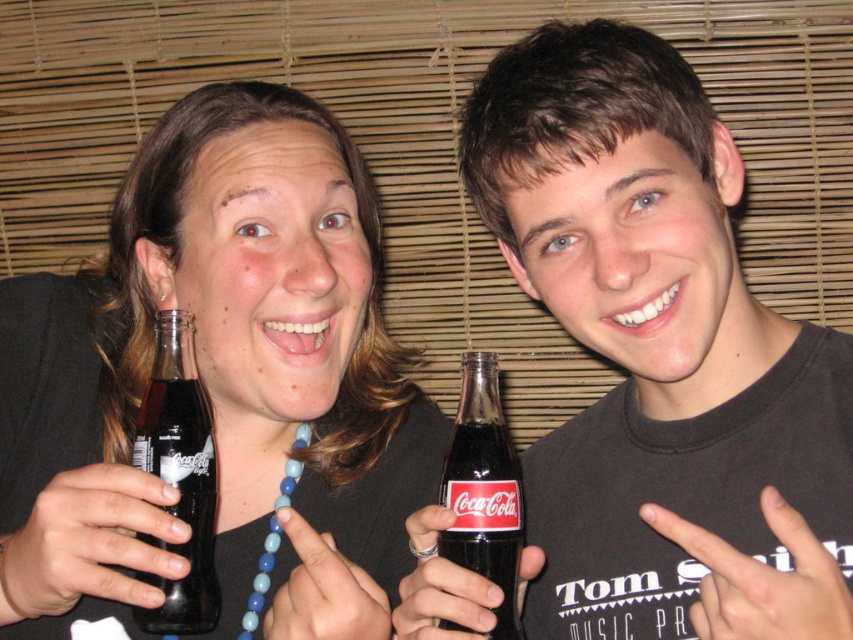
Question: Estimate the real-world distances between objects in this image. Which object is farther from the black glass coca-cola bottle at left?

Choices:
 (A) translucent glass bottle at left
 (B) black glass bottle at right
 (C) black glass coca-cola bottle at center

Answer: (B)

Question: Does black glass bottle at right come behind black glass coca-cola bottle at left?

Choices:
 (A) no
 (B) yes

Answer: (A)

Question: Is black glass bottle at right bigger than black glass coca-cola bottle at center?

Choices:
 (A) no
 (B) yes

Answer: (B)

Question: Does black glass bottle at right appear under translucent glass bottle at left?

Choices:
 (A) yes
 (B) no

Answer: (B)

Question: Which is nearer to the translucent glass bottle at left?

Choices:
 (A) black glass bottle at right
 (B) black glass coca-cola bottle at left
 (C) black glass coca-cola bottle at center

Answer: (B)

Question: Which point is closer to the camera?

Choices:
 (A) [514, 525]
 (B) [677, 323]

Answer: (A)